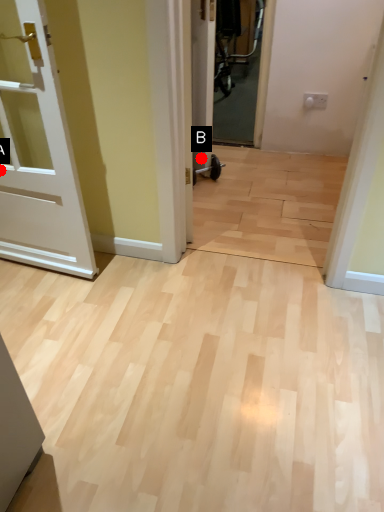
Question: Two points are circled on the image, labeled by A and B beside each circle. Which point appears closest to the camera in this image?

Choices:
 (A) A is closer
 (B) B is closer

Answer: (A)